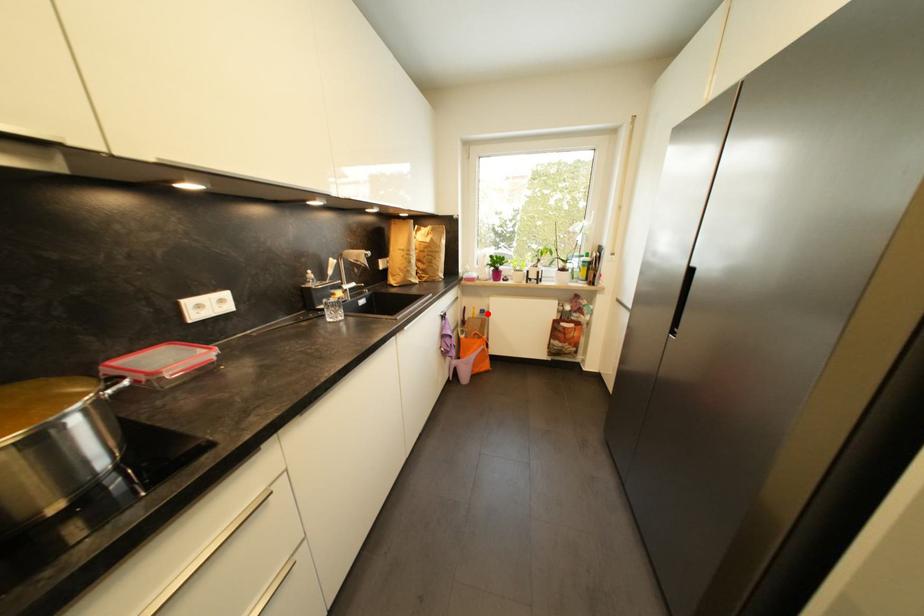
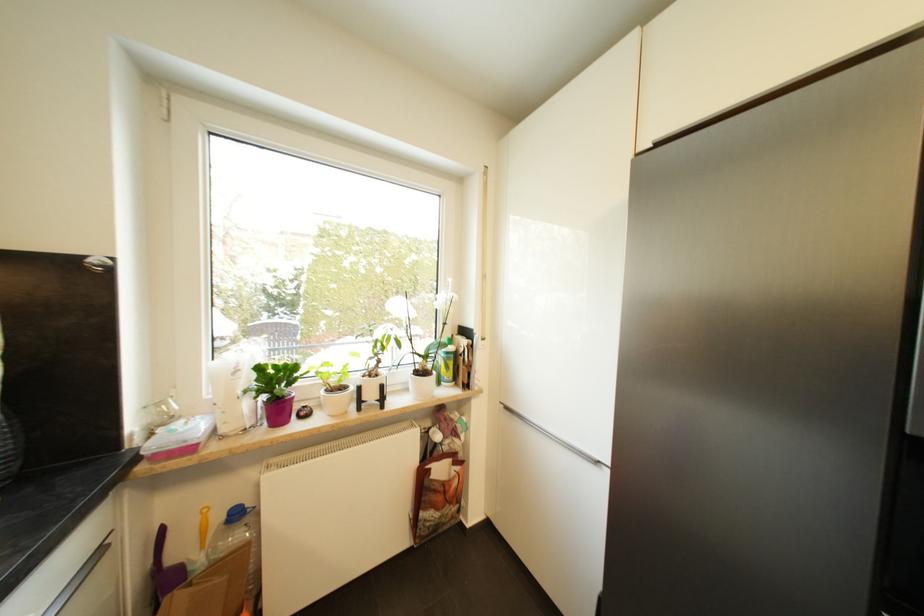
Where in the second image is the point corresponding to the highlighted location from the first image?

(241, 517)